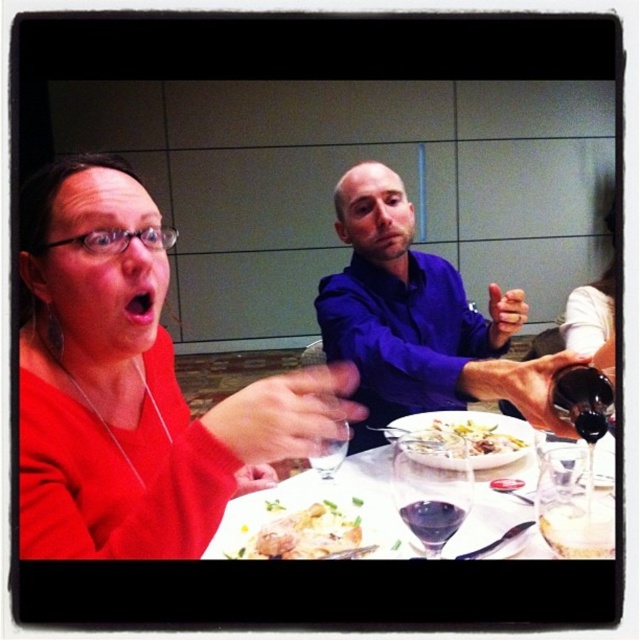
You are standing in front of the dining table and want to place a 30 inch long object on the table. Is there enough space between you and the point at coordinates point (568,515) to place it?

The distance of point (568,515) from viewer is 29.78 inches. Since the object is 30 inches long, it might not fit as the available space is slightly shorter than the object.

You are standing in the dining area and want to place a 30 inch long decorative item on the table. There is a point at coordinates point (323, 556) that is 32.29 inches away from you. Can you fit the item from that point to the edge of the table?

The distance from the point (323, 556) to the viewer is 32.29 inches. Since the decorative item is 30 inches long, it can fit within that distance as 30 is less than 32.29.

You are a chef trying to locate the white creamy sauce at center and the dark glass wine at lower right on a dining table. According to the scene, which object is positioned to the left of the other?

The white creamy sauce at center is to the left of dark glass wine at lower right.